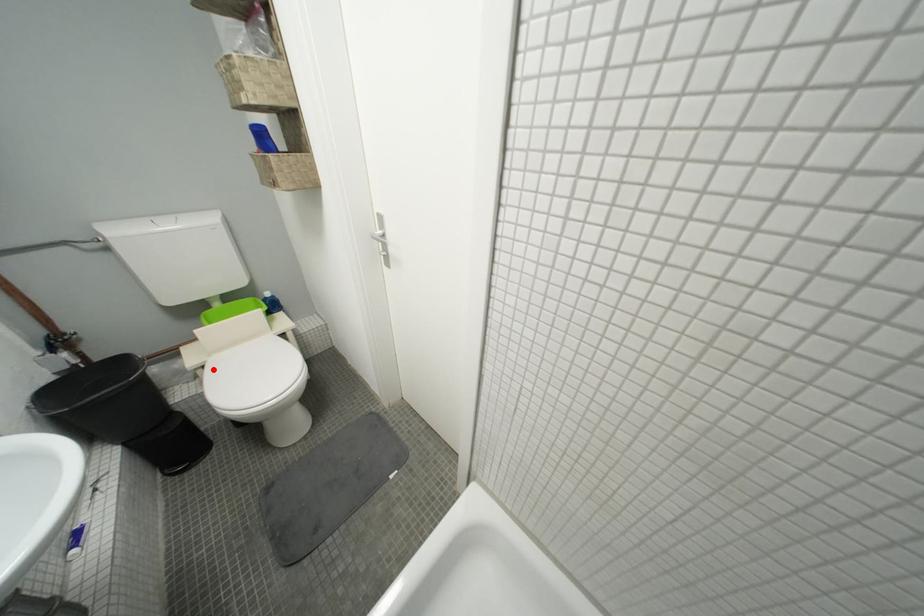
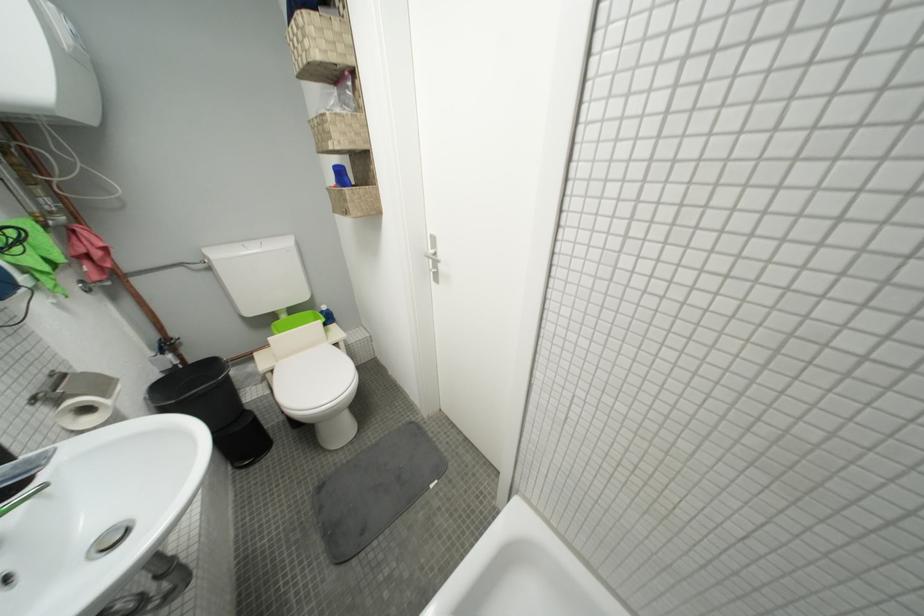
Locate, in the second image, the point that corresponds to the highlighted location in the first image.

(281, 373)